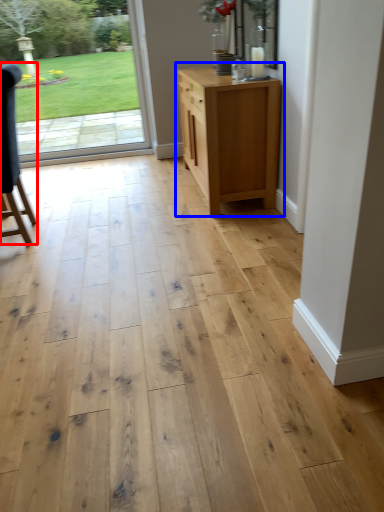
Question: Which object appears closest to the camera in this image, chair (highlighted by a red box) or chest of drawers (highlighted by a blue box)?

Choices:
 (A) chair
 (B) chest of drawers

Answer: (A)